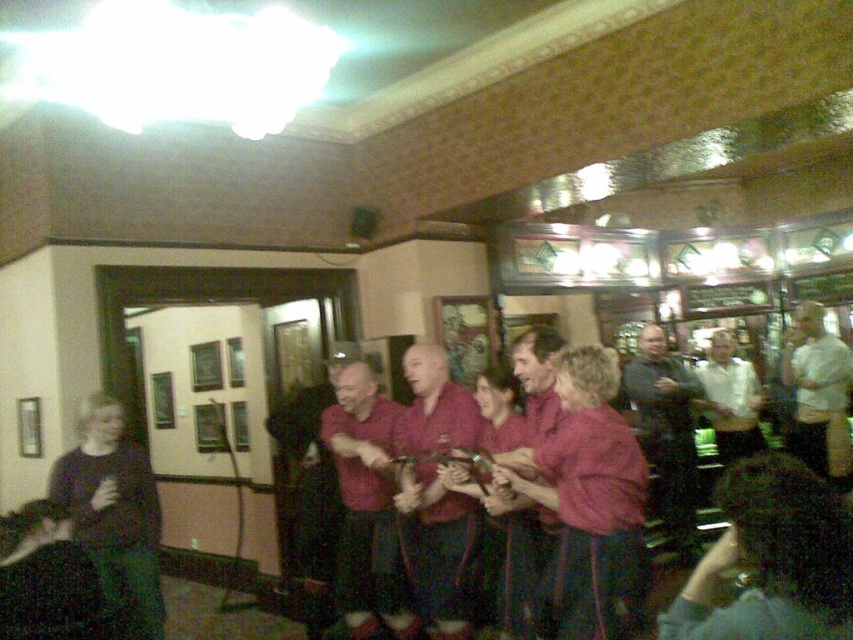
You are a photographer standing at the center of the pub. You notice a point at coordinates (665,429) in the image. Which object at the center of the pub is this point located on?

The point at coordinates (665,429) is located on the dark gray sweater at center.

From the picture: You are a photographer positioned at the back of the pub. You want to take a photo of both the maroon fabric shirt at center and the white shirt at center without any obstruction. Based on their heights, which shirt should you focus on first to ensure both are visible in the frame?

The maroon fabric shirt at center is much taller than the white shirt at center. To ensure both are visible, focus on the taller maroon fabric shirt at center first, then adjust the camera angle to include the shorter white shirt at center in the frame.

You are a photographer standing in the pub and see the maroon fabric shirt at center and the white shirt at center. Which one is more to the left?

The maroon fabric shirt at center is more to the left because it is positioned on the left side of the white shirt at center.